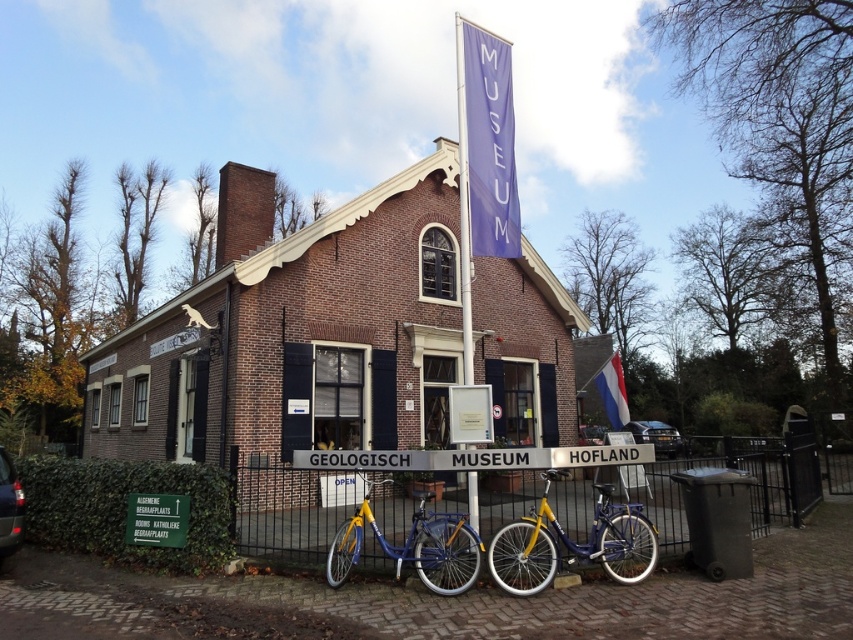
Is point (492, 152) positioned after point (7, 552)?

Yes, it is behind point (7, 552).

Does blue fabric banner at upper center have a larger size compared to shiny black car at lower left?

Correct, blue fabric banner at upper center is larger in size than shiny black car at lower left.

Identify the location of blue fabric banner at upper center. Image resolution: width=853 pixels, height=640 pixels. (490, 144).

Is purple fabric banner at center smaller than white fabric flag at right?

No.

Can you confirm if purple fabric banner at center is taller than white fabric flag at right?

Yes.

The height and width of the screenshot is (640, 853). I want to click on purple fabric banner at center, so click(463, 209).

Does black metal fence at center have a lesser height compared to purple fabric banner at center?

Indeed, black metal fence at center has a lesser height compared to purple fabric banner at center.

Is black metal fence at center above purple fabric banner at center?

Incorrect, black metal fence at center is not positioned above purple fabric banner at center.

Is point (241, 477) less distant than point (467, 164)?

No.

Find the location of a particular element. black metal fence at center is located at coordinates (498, 490).